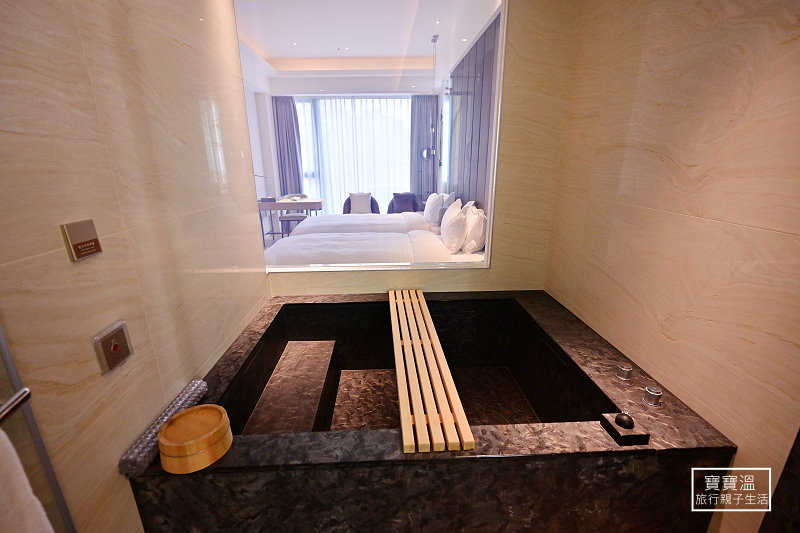
Find the location of `white towel`. white towel is located at coordinates (17, 506).